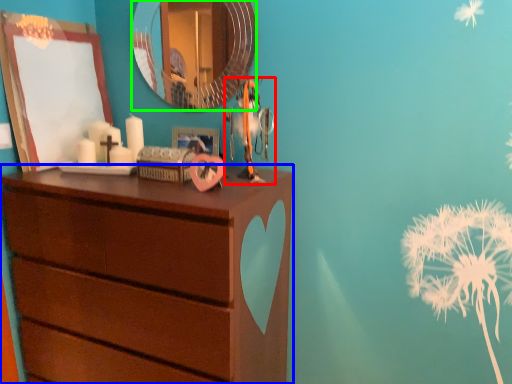
Question: Which object is the closest to the toy (highlighted by a red box)? Choose among these: chest of drawers (highlighted by a blue box) or mirror (highlighted by a green box).

Choices:
 (A) chest of drawers
 (B) mirror

Answer: (A)